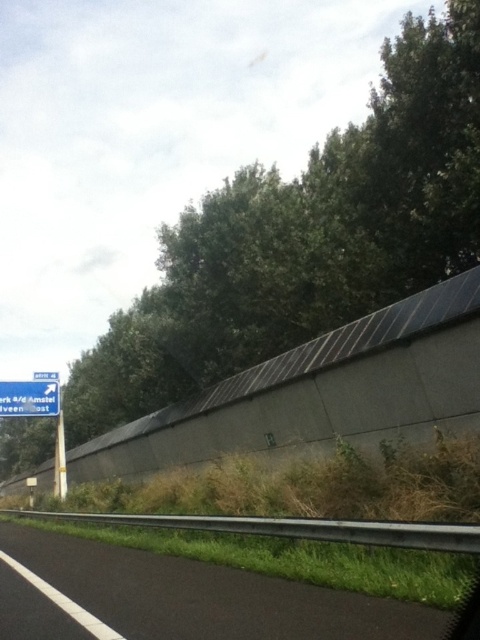
You are a driver approaching the blue plastic sign at left and the black asphalt highway at lower left. Which object will you encounter first as you drive forward?

A: The black asphalt highway at lower left is positioned under the blue plastic sign at left, so you will encounter the blue plastic sign at left first before reaching the black asphalt highway at lower left.

You are a driver approaching the black asphalt highway at lower left and the blue plastic sign at left. Which object is bigger in size?

The black asphalt highway at lower left is larger in size than the blue plastic sign at left.